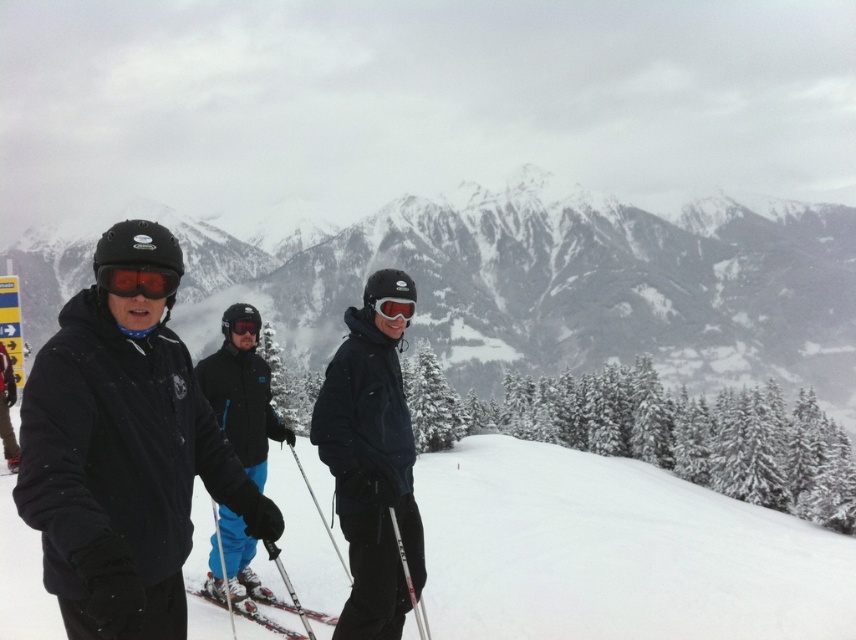
Question: Which is farther from the white matte skis at center?

Choices:
 (A) glossy plastic goggles at center
 (B) red reflective lens goggles at center
 (C) metallic silver ski pole at center
 (D) matte black ski jacket at center

Answer: (B)

Question: Is matte black ski jacket at center to the right of metallic silver ski pole at center from the viewer's perspective?

Choices:
 (A) no
 (B) yes

Answer: (A)

Question: Can you confirm if matte black ski jacket at center is positioned below glossy plastic goggles at center?

Choices:
 (A) no
 (B) yes

Answer: (B)

Question: Which point is farther to the camera?

Choices:
 (A) (425, 628)
 (B) (239, 611)
 (C) (382, 316)

Answer: (C)

Question: Which point is closer to the camera?

Choices:
 (A) (107, 288)
 (B) (361, 449)
 (C) (375, 301)

Answer: (A)

Question: Can you confirm if snowy mountain at center is thinner than white matte skis at center?

Choices:
 (A) no
 (B) yes

Answer: (A)